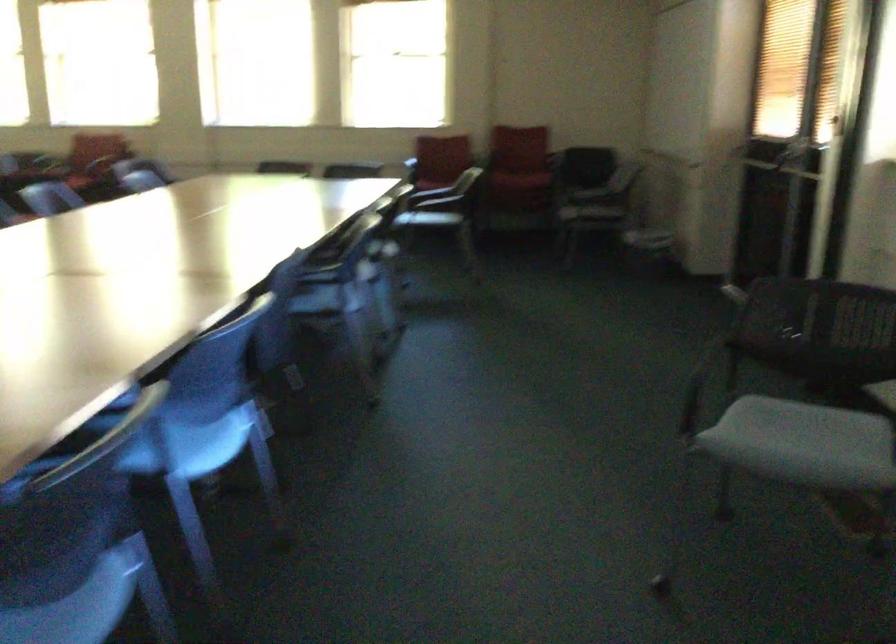
Describe the element at coordinates (515, 192) in the screenshot. I see `the red chair sitting surface` at that location.